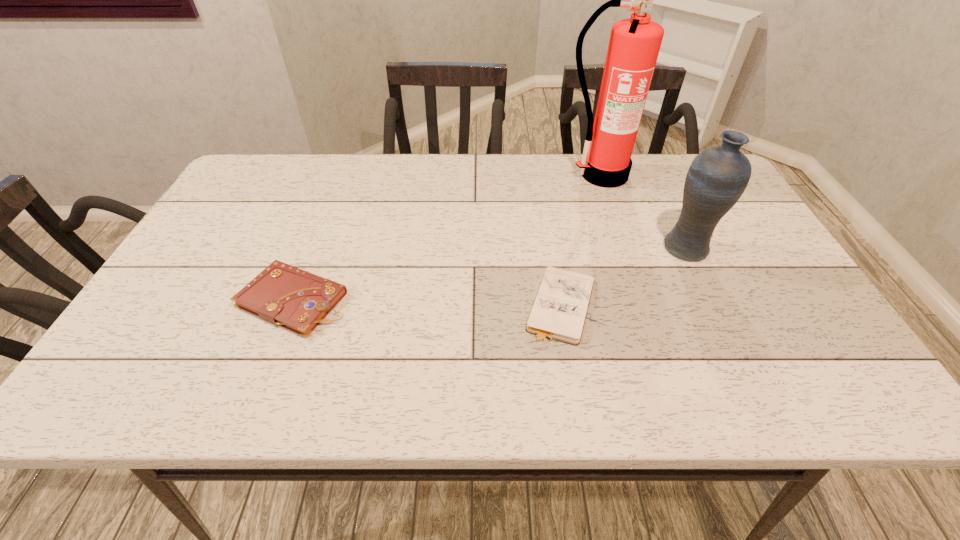
Find the location of a particular element. The image size is (960, 540). the farthest object is located at coordinates (634, 45).

Where is `the tallest object`? the tallest object is located at coordinates (634, 45).

Find the location of `the second farthest object`. the second farthest object is located at coordinates (716, 179).

What are the coordinates of `the second tallest object` in the screenshot? It's located at (716, 179).

In order to click on the left notebook in this screenshot , I will do `click(284, 295)`.

At what (x,y) coordinates should I click in order to perform the action: click on the leftmost object. Please return your answer as a coordinate pair (x, y). This screenshot has width=960, height=540. Looking at the image, I should click on (284, 295).

This screenshot has height=540, width=960. What are the coordinates of `the right notebook` in the screenshot? It's located at (560, 308).

Locate an element on the screen. the shorter notebook is located at coordinates (560, 308).

You are a GUI agent. You are given a task and a screenshot of the screen. Output one action in this format:
    pyautogui.click(x=<x>, y=<y>)
    Task: Click on the vacant area situated 0.390m with the nozzle aimed from the fire extinguisher
    The height and width of the screenshot is (540, 960).
    Given the screenshot: What is the action you would take?
    pyautogui.click(x=639, y=285)

Find the location of a particular element. This screenshot has height=540, width=960. vacant space located on the right of the vase is located at coordinates (751, 248).